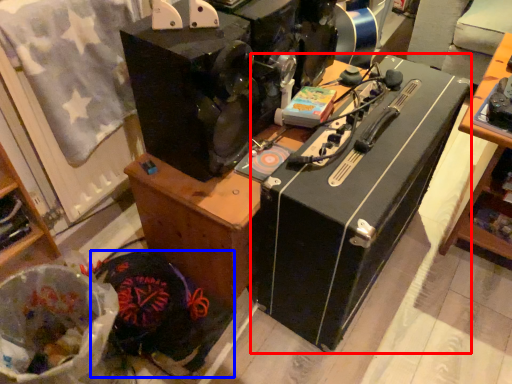
Question: Among these objects, which one is farthest to the camera, wide (highlighted by a red box) or waste (highlighted by a blue box)?

Choices:
 (A) wide
 (B) waste

Answer: (B)